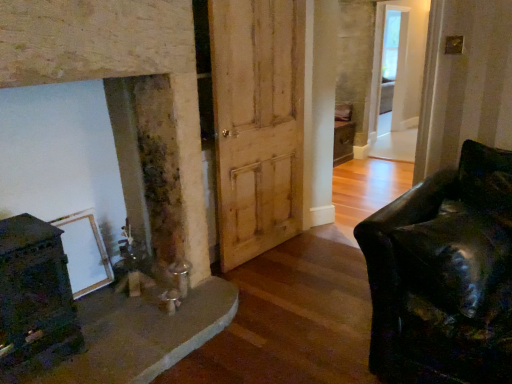
I want to click on free space underneath natural wood barn door at center (from a real-world perspective), so click(x=260, y=255).